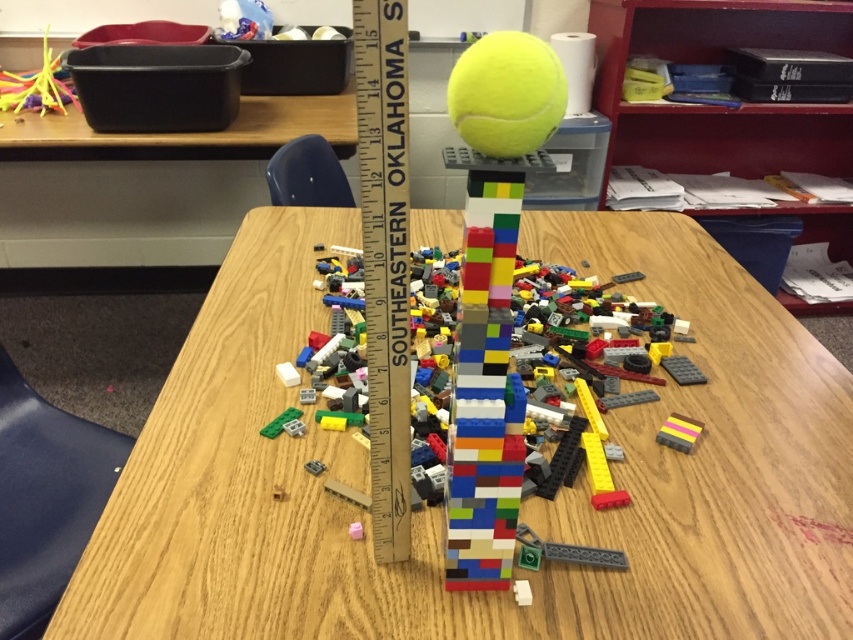
Question: Is wooden table at center above translucent yellow straws at upper left?

Choices:
 (A) no
 (B) yes

Answer: (A)

Question: Is yellow fuzzy tennis ball at upper center above translucent yellow straws at upper left?

Choices:
 (A) yes
 (B) no

Answer: (B)

Question: Which of the following is the farthest from the observer?

Choices:
 (A) (556, 113)
 (B) (468, 504)

Answer: (B)

Question: Where is wooden at center located in relation to yellow fuzzy tennis ball at upper center in the image?

Choices:
 (A) left
 (B) right

Answer: (A)

Question: Which object is the farthest from the translucent yellow straws at upper left?

Choices:
 (A) wooden at center
 (B) wooden table at center

Answer: (A)

Question: Among these points, which one is farthest from the camera?

Choices:
 (A) (x=546, y=609)
 (B) (x=483, y=193)
 (C) (x=523, y=90)
 (D) (x=383, y=305)

Answer: (A)